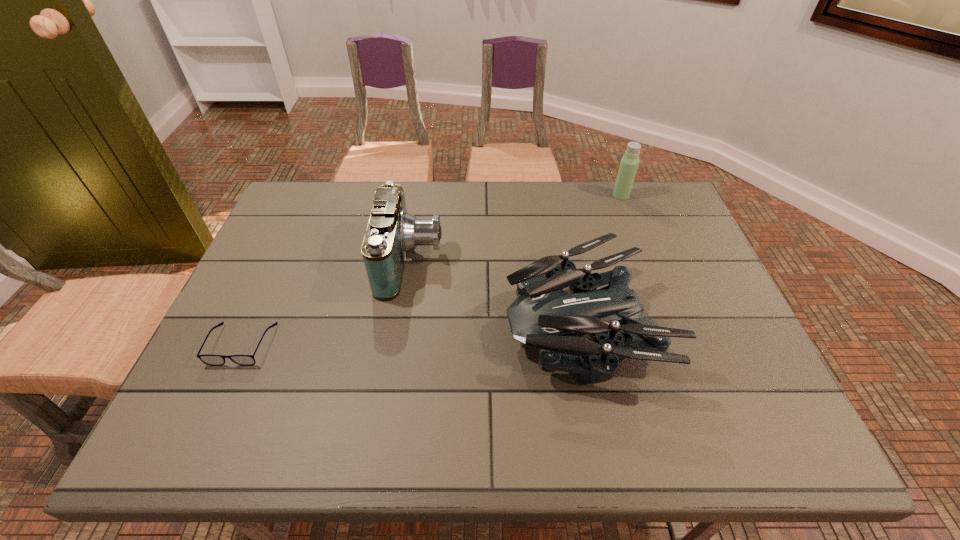
Locate an element on the screen. Image resolution: width=960 pixels, height=540 pixels. free spot between the drone and the second object from left to right is located at coordinates (497, 292).

This screenshot has height=540, width=960. Identify the location of free space between the farthest object and the camcorder. (516, 228).

The height and width of the screenshot is (540, 960). I want to click on free space between the shortest object and the farthest object, so click(x=432, y=270).

This screenshot has height=540, width=960. Find the location of `vacant space that is in between the spectacles and the second shortest object`. vacant space that is in between the spectacles and the second shortest object is located at coordinates (413, 334).

You are a GUI agent. You are given a task and a screenshot of the screen. Output one action in this format:
    pyautogui.click(x=<x>, y=<y>)
    Task: Click on the free space that is in between the thermos bottle and the shortest object
    
    Given the screenshot: What is the action you would take?
    pyautogui.click(x=432, y=270)

The width and height of the screenshot is (960, 540). What are the coordinates of `object that ranks as the third closest to the third object from right to left` in the screenshot? It's located at (629, 163).

Select which object is the second closest to the third tallest object. Please provide its 2D coordinates. Your answer should be formatted as a tuple, i.e. [(x, y)], where the tuple contains the x and y coordinates of a point satisfying the conditions above.

[(629, 163)]

Locate an element on the screen. vacant space that satisfies the following two spatial constraints: 1. on the back side of the second shortest object; 2. on the front-facing side of the camcorder is located at coordinates (570, 261).

The image size is (960, 540). Identify the location of vacant area that satisfies the following two spatial constraints: 1. on the front-facing side of the third object from right to left; 2. on the front-facing side of the shortest object. (398, 345).

Locate an element on the screen. The height and width of the screenshot is (540, 960). vacant point that satisfies the following two spatial constraints: 1. on the front-facing side of the camcorder; 2. on the front-facing side of the spectacles is located at coordinates (398, 345).